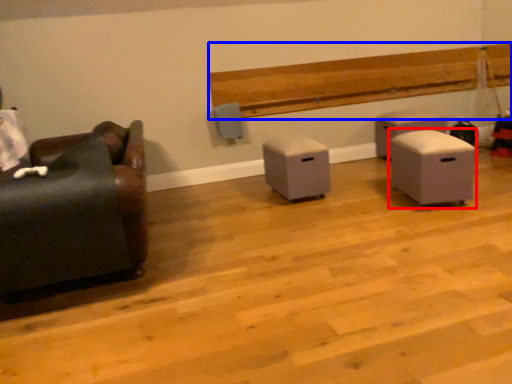
Question: Which object is closer to the camera taking this photo, furniture (highlighted by a red box) or hardwood (highlighted by a blue box)?

Choices:
 (A) furniture
 (B) hardwood

Answer: (A)